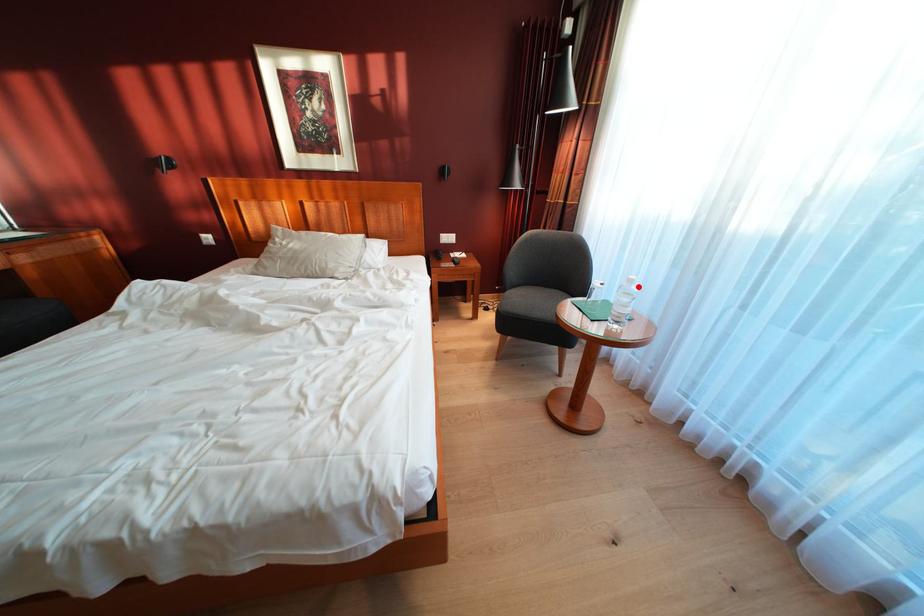
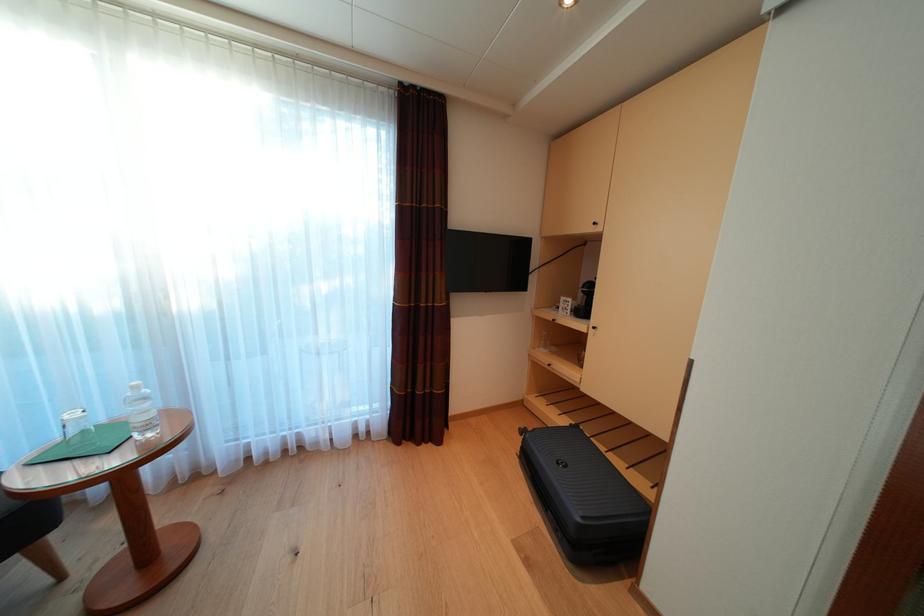
Question: I am providing you with two images of the same scene from different viewpoints. A red point is marked on the first image. At the location where the point appears in image 1, is it still visible in image 2?

Choices:
 (A) Yes
 (B) No

Answer: (A)